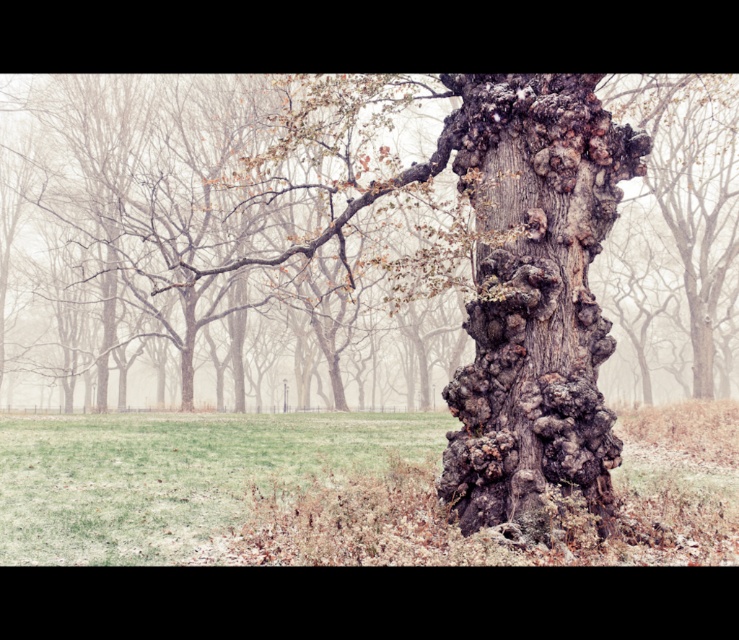
Looking at this image, you are standing in the park and want to take a photo of both the rough bark oak tree at center and the dark gray rough bark tree trunk at center. If you want to capture both in the same frame, which object should you focus on to ensure they are both visible?

You should focus on the rough bark oak tree at center because it is wider than the dark gray rough bark tree trunk at center, allowing both to fit in the frame.

You are standing in the misty park and want to locate the rough bark tree trunk at center. According to the coordinates provided, where should you look relative to the image center?

The rough bark tree trunk at center is located at coordinates point (364, 237), which is slightly to the left and just below the image center.